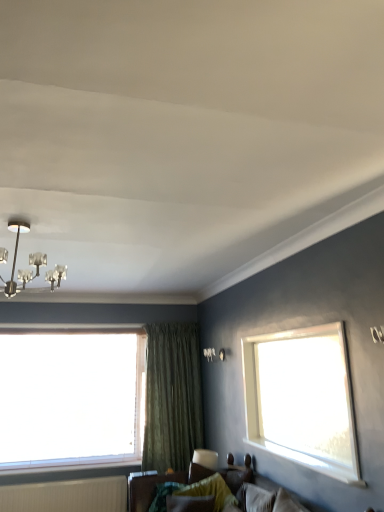
Question: Considering their positions, is velvet green pillow at lower center located in front of or behind metallic chandelier at upper left?

Choices:
 (A) behind
 (B) front

Answer: (A)

Question: Would you say velvet green pillow at lower center is to the left or to the right of metallic chandelier at upper left in the picture?

Choices:
 (A) right
 (B) left

Answer: (A)

Question: Based on their relative distances, which object is farther from the white ribbed radiator at lower left?

Choices:
 (A) velvet green pillow at lower center
 (B) metallic chandelier at upper left
 (C) green textured curtain at center
 (D) transparent glass window at left
 (E) textured fabric couch at lower center

Answer: (B)

Question: Which is farther from the green textured curtain at center?

Choices:
 (A) velvet green pillow at lower center
 (B) metallic chandelier at upper left
 (C) transparent glass window at left
 (D) white ribbed radiator at lower left
 (E) textured fabric couch at lower center

Answer: (B)